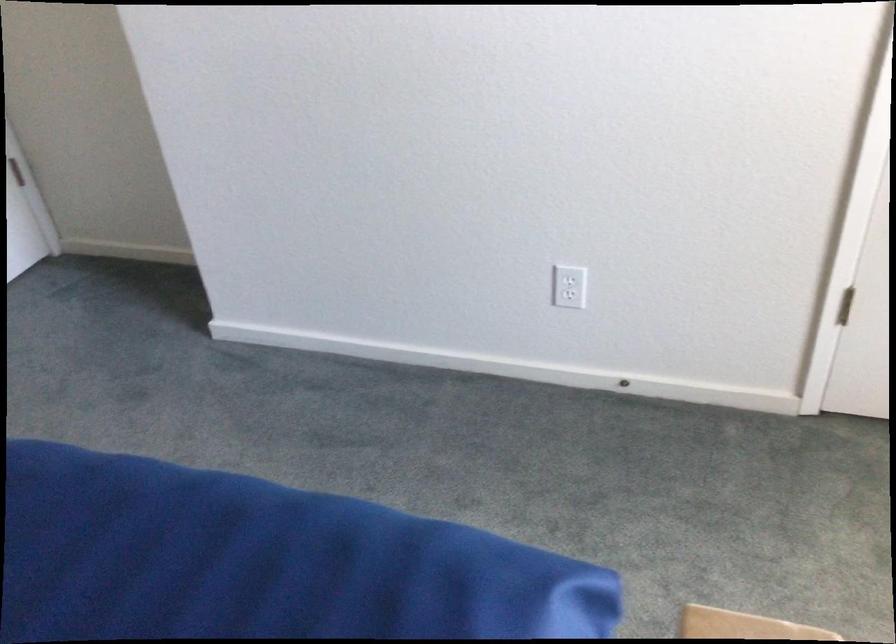
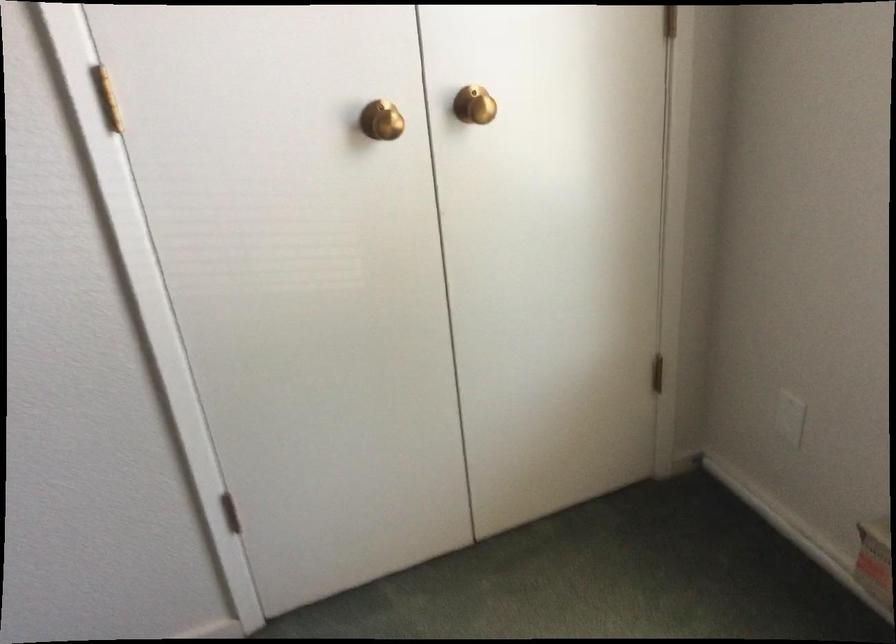
Question: The camera is either moving clockwise (left) or counter-clockwise (right) around the object. The first image is from the beginning of the video and the second image is from the end. Is the camera moving left or right when shooting the video?

Choices:
 (A) Left
 (B) Right

Answer: (A)